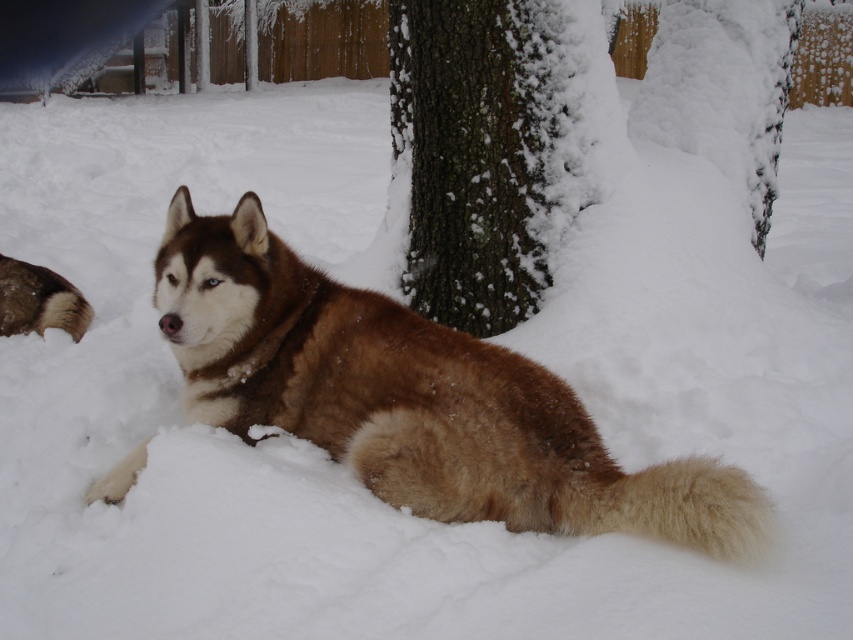
Is brown fur dog at center smaller than brown fluffy tail at lower left?

No, brown fur dog at center is not smaller than brown fluffy tail at lower left.

Does point (276, 380) come closer to viewer compared to point (76, 339)?

Yes, it is.

Who is more forward, (431, 484) or (74, 308)?

Point (431, 484) is more forward.

Locate an element on the screen. The width and height of the screenshot is (853, 640). brown fur dog at center is located at coordinates (415, 397).

The width and height of the screenshot is (853, 640). Find the location of `snow-covered bark at center`. snow-covered bark at center is located at coordinates (485, 152).

Does snow-covered bark at center have a lesser height compared to snow-covered bark at upper center?

In fact, snow-covered bark at center may be taller than snow-covered bark at upper center.

Is point (524, 182) positioned behind point (712, 93)?

No, it is not.

At what (x,y) coordinates should I click in order to perform the action: click on snow-covered bark at center. Please return your answer as a coordinate pair (x, y). The image size is (853, 640). Looking at the image, I should click on (485, 152).

Between brown fur dog at center and snow-covered bark at center, which one has less height?

With less height is brown fur dog at center.

Who is positioned more to the left, brown fur dog at center or snow-covered bark at center?

From the viewer's perspective, brown fur dog at center appears more on the left side.

Which is behind, point (357, 317) or point (425, 8)?

The point (425, 8) is behind.

The image size is (853, 640). What are the coordinates of `brown fur dog at center` in the screenshot? It's located at (415, 397).